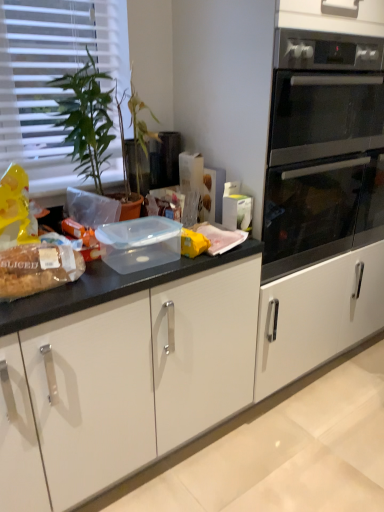
Question: Is white plastic blinds at upper left oriented away from stainless steel oven at right?

Choices:
 (A) yes
 (B) no

Answer: (B)

Question: Does white plastic blinds at upper left come behind stainless steel oven at right?

Choices:
 (A) no
 (B) yes

Answer: (B)

Question: Is white plastic blinds at upper left bigger than stainless steel oven at right?

Choices:
 (A) yes
 (B) no

Answer: (B)

Question: Does white plastic blinds at upper left have a lesser width compared to stainless steel oven at right?

Choices:
 (A) no
 (B) yes

Answer: (B)

Question: Is stainless steel oven at right located within white plastic blinds at upper left?

Choices:
 (A) no
 (B) yes

Answer: (A)

Question: In terms of height, does stainless steel oven at right look taller or shorter compared to green glossy plant at left?

Choices:
 (A) tall
 (B) short

Answer: (A)

Question: Considering the positions of point (375, 55) and point (89, 175), is point (375, 55) closer or farther from the camera than point (89, 175)?

Choices:
 (A) closer
 (B) farther

Answer: (B)

Question: Is stainless steel oven at right inside or outside of green glossy plant at left?

Choices:
 (A) outside
 (B) inside

Answer: (A)

Question: Considering the positions of stainless steel oven at right and green glossy plant at left in the image, is stainless steel oven at right bigger or smaller than green glossy plant at left?

Choices:
 (A) small
 (B) big

Answer: (B)

Question: Looking at their shapes, would you say green glossy plant at left is wider or thinner than translucent plastic bread at left?

Choices:
 (A) wide
 (B) thin

Answer: (A)

Question: Would you say green glossy plant at left is to the left or to the right of translucent plastic bread at left in the picture?

Choices:
 (A) right
 (B) left

Answer: (A)

Question: From the image's perspective, is green glossy plant at left located above or below translucent plastic bread at left?

Choices:
 (A) above
 (B) below

Answer: (A)

Question: Considering their positions, is green glossy plant at left located in front of or behind translucent plastic bread at left?

Choices:
 (A) behind
 (B) front

Answer: (A)

Question: Relative to white plastic blinds at upper left, is green glossy plant at left in front or behind?

Choices:
 (A) front
 (B) behind

Answer: (A)

Question: In terms of width, does green glossy plant at left look wider or thinner when compared to white plastic blinds at upper left?

Choices:
 (A) thin
 (B) wide

Answer: (B)